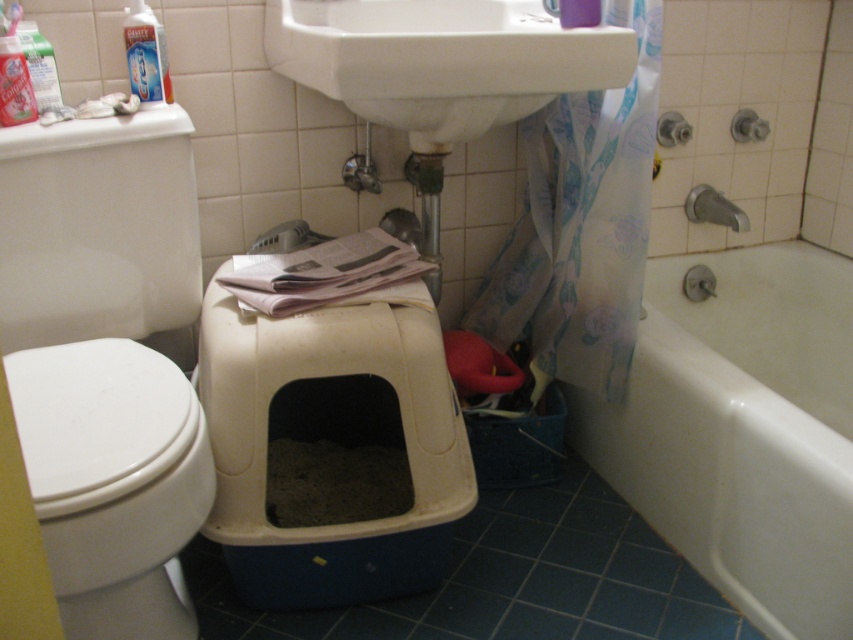
Question: Is the position of white glossy toilet lid at left more distant than that of matte silver faucet at upper right?

Choices:
 (A) yes
 (B) no

Answer: (B)

Question: Does white glossy sink at upper center have a smaller size compared to white glossy toilet lid at left?

Choices:
 (A) no
 (B) yes

Answer: (A)

Question: Which object is positioned farthest from the satin silver faucet at upper right?

Choices:
 (A) white glossy bathtub at lower right
 (B) white glossy toilet at left

Answer: (B)

Question: Which object appears closest to the camera in this image?

Choices:
 (A) white glossy bathtub at lower right
 (B) white glossy toilet at left
 (C) satin silver faucet at upper right
 (D) matte silver faucet at upper right

Answer: (A)

Question: Is white glossy bathtub at lower right smaller than matte silver faucet at upper right?

Choices:
 (A) yes
 (B) no

Answer: (B)

Question: Which point is farther from the camera taking this photo?

Choices:
 (A) (701, 189)
 (B) (461, 129)
 (C) (740, 134)

Answer: (A)